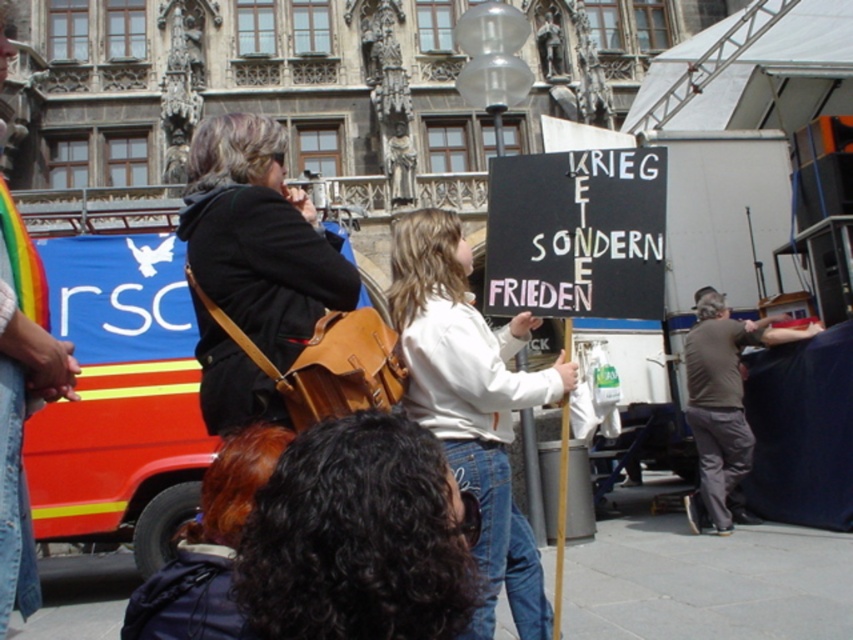
Consider the image. Who is positioned more to the left, white cotton shirt at center or black chalkboard at center?

white cotton shirt at center is more to the left.

Which is behind, point (469, 364) or point (490, 163)?

The point (490, 163) is behind.

The image size is (853, 640). Identify the location of white cotton shirt at center. point(473,403).

Describe the element at coordinates (259, 237) in the screenshot. The image size is (853, 640). I see `matte black jacket at center` at that location.

Can you confirm if matte black jacket at center is taller than black chalkboard at center?

Yes, matte black jacket at center is taller than black chalkboard at center.

Is point (216, 433) closer to viewer compared to point (541, 173)?

That is True.

Identify the location of matte black jacket at center. Image resolution: width=853 pixels, height=640 pixels. (259, 237).

Is matte black jacket at center positioned at the back of denim jacket at lower left?

Yes, it is.

Does point (222, 182) come behind point (73, 369)?

Yes, point (222, 182) is farther from viewer.

Locate an element on the screen. The image size is (853, 640). matte black jacket at center is located at coordinates (259, 237).